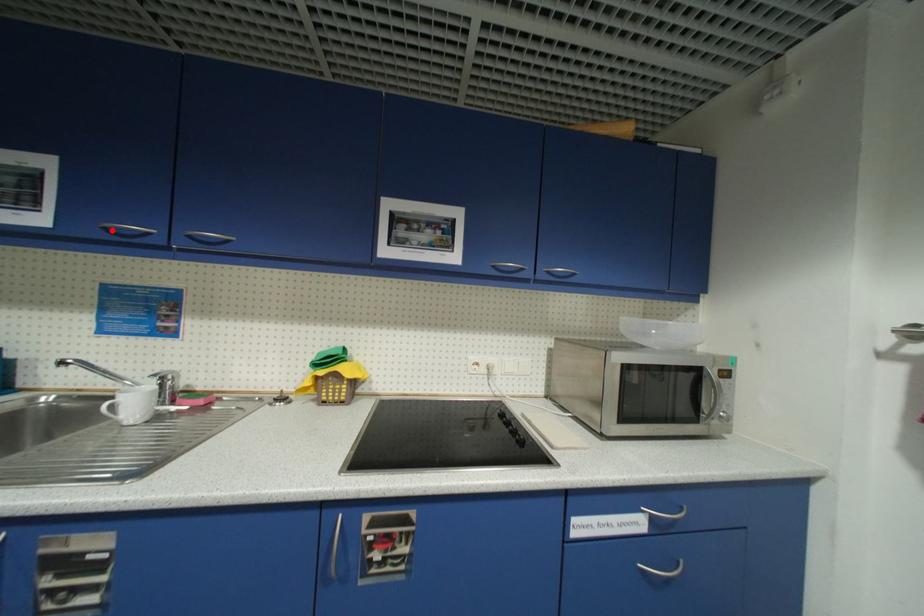
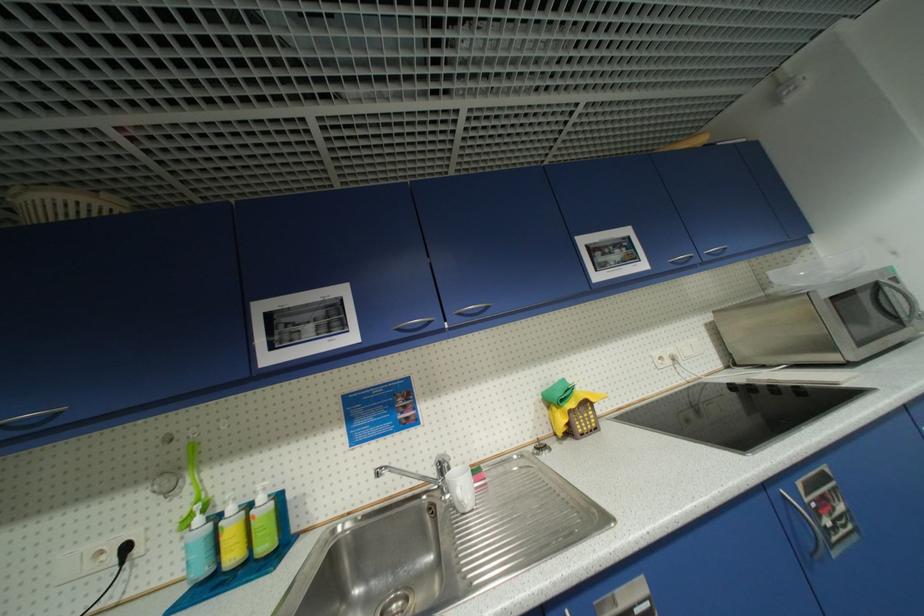
Locate, in the second image, the point that corresponds to the highlighted location in the first image.

(405, 331)